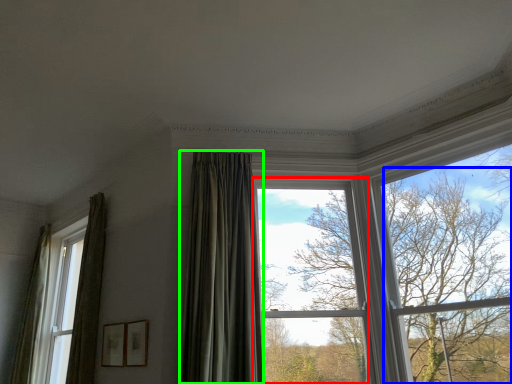
Question: Based on their relative distances, which object is farther from window (highlighted by a red box)? Choose from tree (highlighted by a blue box) and curtain (highlighted by a green box).

Choices:
 (A) tree
 (B) curtain

Answer: (A)